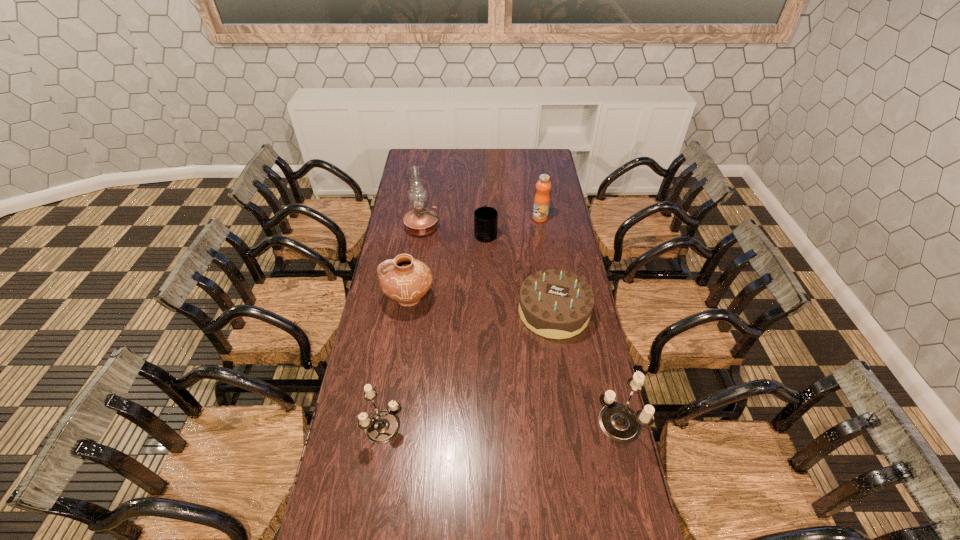
Locate an element on the screen. This screenshot has width=960, height=540. birthday cake that is at the right edge is located at coordinates (553, 303).

Find the location of `vacant region at the far edge`. vacant region at the far edge is located at coordinates (501, 161).

This screenshot has height=540, width=960. I want to click on vacant space at the near edge, so click(x=434, y=508).

At what (x,y) coordinates should I click in order to perform the action: click on vacant space at the left edge of the desktop. Please return your answer as a coordinate pair (x, y). This screenshot has height=540, width=960. Looking at the image, I should click on (396, 246).

The height and width of the screenshot is (540, 960). What are the coordinates of `blank space at the right edge` in the screenshot? It's located at (567, 247).

This screenshot has width=960, height=540. I want to click on vacant space that's between the birthday cake and the oil lamp, so click(488, 270).

This screenshot has height=540, width=960. In order to click on free spot between the mug and the tallest object in this screenshot , I will do `click(454, 231)`.

Where is `vacant point located between the oil lamp and the left candle holder`? vacant point located between the oil lamp and the left candle holder is located at coordinates (403, 327).

Locate an element on the screen. The image size is (960, 540). free area in between the fruit juice and the pottery is located at coordinates (474, 259).

You are a GUI agent. You are given a task and a screenshot of the screen. Output one action in this format:
    pyautogui.click(x=<x>, y=<y>)
    Task: Click on the free space between the birthday cake and the fourth object from right to left
    The width and height of the screenshot is (960, 540).
    Given the screenshot: What is the action you would take?
    pyautogui.click(x=519, y=272)